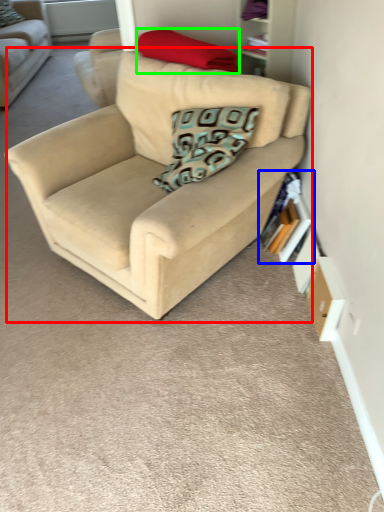
Question: Which object is positioned closest to studio couch (highlighted by a red box)? Select from book (highlighted by a blue box) and pillow (highlighted by a green box).

Choices:
 (A) book
 (B) pillow

Answer: (A)